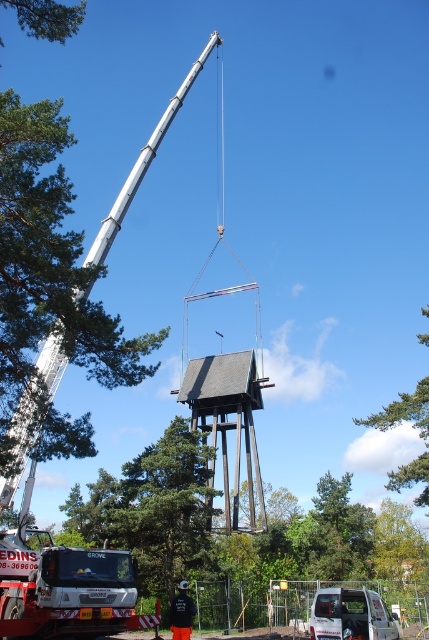
Between silver metallic crane at upper left and green leafy tree at upper center, which one is positioned lower?

green leafy tree at upper center is lower down.

Based on the photo, who is positioned more to the left, silver metallic crane at upper left or green leafy tree at upper center?

silver metallic crane at upper left

Which is in front, point (21, 468) or point (426, 497)?

Point (21, 468) is more forward.

Where is `silver metallic crane at upper left`? The height and width of the screenshot is (640, 429). silver metallic crane at upper left is located at coordinates (33, 410).

Does green leafy tree at center come behind green leafy tree at upper center?

Yes, green leafy tree at center is further from the viewer.

Is point (428, 570) positioned after point (398, 401)?

Yes, it is behind point (398, 401).

Image resolution: width=429 pixels, height=640 pixels. I want to click on green leafy tree at center, so click(398, 545).

Between point (217, 404) and point (60, 12), which one is positioned behind?

Point (217, 404)

Does gray wooden tower at center appear on the left side of green leafy tree at upper left?

Incorrect, gray wooden tower at center is not on the left side of green leafy tree at upper left.

Identify the location of gray wooden tower at center. The image size is (429, 640). (229, 422).

This screenshot has height=640, width=429. Find the location of `gray wooden tower at center`. gray wooden tower at center is located at coordinates (229, 422).